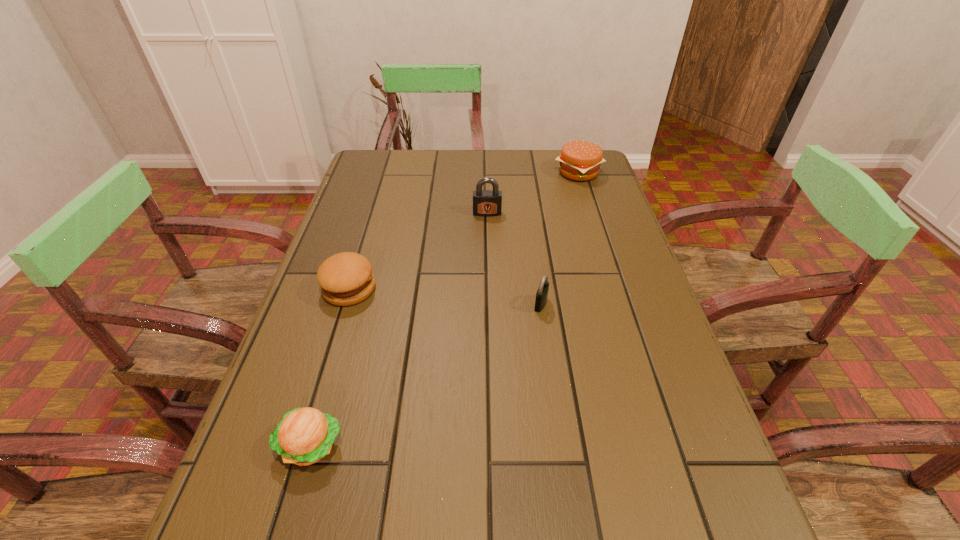
Point out which object is positioned as the second nearest to the second nearest hamburger. Please provide its 2D coordinates. Your answer should be formatted as a tuple, i.e. [(x, y)], where the tuple contains the x and y coordinates of a point satisfying the conditions above.

[(486, 203)]

Locate which object ranks fourth in proximity to the second farthest hamburger. Please provide its 2D coordinates. Your answer should be formatted as a tuple, i.e. [(x, y)], where the tuple contains the x and y coordinates of a point satisfying the conditions above.

[(580, 160)]

Locate an element on the screen. hamburger that is the closest to the nearest hamburger is located at coordinates (346, 278).

Where is `hamburger that stands as the closest to the nearest hamburger`? hamburger that stands as the closest to the nearest hamburger is located at coordinates (346, 278).